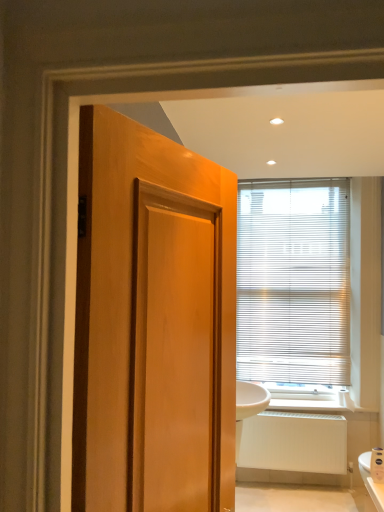
Describe the element at coordinates (293, 442) in the screenshot. I see `white matte radiator at lower right` at that location.

In order to face white matte radiator at lower right, should I rotate leftwards or rightwards?

Rotate right and turn 15.837 degrees.

Where is `white matte radiator at lower right`? white matte radiator at lower right is located at coordinates (293, 442).

This screenshot has height=512, width=384. Identify the location of white textured blinds at upper center. (293, 282).

What do you see at coordinates (293, 282) in the screenshot? I see `white textured blinds at upper center` at bounding box center [293, 282].

Measure the distance between white textured blinds at upper center and camera.

white textured blinds at upper center is 11.01 feet away from camera.

At what (x,y) coordinates should I click in order to perform the action: click on white matte radiator at lower right. Please return your answer as a coordinate pair (x, y). Looking at the image, I should click on (293, 442).

Is white textured blinds at upper center to the left or to the right of white matte radiator at lower right in the image?

From the image, it's evident that white textured blinds at upper center is to the left of white matte radiator at lower right.

Based on the photo, which object is further away from the camera taking this photo, white textured blinds at upper center or white matte radiator at lower right?

Positioned behind is white textured blinds at upper center.

Does point (257, 234) lie in front of point (264, 448)?

No, (257, 234) is behind (264, 448).

From the image's perspective, is white textured blinds at upper center located above or below white matte radiator at lower right?

Clearly, from the image's perspective, white textured blinds at upper center is above white matte radiator at lower right.

From a real-world perspective, is white textured blinds at upper center under white matte radiator at lower right?

No, from a real-world perspective, white textured blinds at upper center is not beneath white matte radiator at lower right.

Does white textured blinds at upper center have a lesser width compared to white matte radiator at lower right?

Yes.

Consider the image. Is white textured blinds at upper center taller than white matte radiator at lower right?

Yes.

Can you confirm if white textured blinds at upper center is smaller than white matte radiator at lower right?

Actually, white textured blinds at upper center might be larger than white matte radiator at lower right.

Is white textured blinds at upper center situated inside white matte radiator at lower right or outside?

The correct answer is: outside.

Is white textured blinds at upper center not close to white matte radiator at lower right?

Actually, white textured blinds at upper center and white matte radiator at lower right are a little close together.

Is white textured blinds at upper center facing towards white matte radiator at lower right?

No, white textured blinds at upper center is not facing towards white matte radiator at lower right.

How different are the orientations of white textured blinds at upper center and white matte radiator at lower right in degrees?

0.1 degrees separate the facing orientations of white textured blinds at upper center and white matte radiator at lower right.

The image size is (384, 512). What are the coordinates of `radiator in front of the white textured blinds at upper center` in the screenshot? It's located at (x=293, y=442).

Consider the image. Visually, is white matte radiator at lower right positioned to the left or to the right of white textured blinds at upper center?

In the image, white matte radiator at lower right appears on the right side of white textured blinds at upper center.

Is white matte radiator at lower right behind white textured blinds at upper center?

No, the depth of white matte radiator at lower right is less than that of white textured blinds at upper center.

Between point (340, 423) and point (294, 289), which one is positioned in front?

The point (340, 423) is closer to the camera.

From the image's perspective, relative to white textured blinds at upper center, is white matte radiator at lower right above or below?

white matte radiator at lower right is below white textured blinds at upper center.

From a real-world perspective, between white matte radiator at lower right and white textured blinds at upper center, who is vertically higher?

white textured blinds at upper center.

Considering the relative sizes of white matte radiator at lower right and white textured blinds at upper center in the image provided, is white matte radiator at lower right wider than white textured blinds at upper center?

Indeed, white matte radiator at lower right has a greater width compared to white textured blinds at upper center.

Does white matte radiator at lower right have a lesser height compared to white textured blinds at upper center?

Yes.

Considering the sizes of objects white matte radiator at lower right and white textured blinds at upper center in the image provided, who is smaller, white matte radiator at lower right or white textured blinds at upper center?

With smaller size is white matte radiator at lower right.

Is white matte radiator at lower right not within white textured blinds at upper center?

white matte radiator at lower right lies outside white textured blinds at upper center's area.

Is white matte radiator at lower right with white textured blinds at upper center?

No, white matte radiator at lower right is not touching white textured blinds at upper center.

Is white matte radiator at lower right positioned with its back to white textured blinds at upper center?

white matte radiator at lower right does not have its back to white textured blinds at upper center.

Where is `window blind behind the white matte radiator at lower right`? window blind behind the white matte radiator at lower right is located at coordinates (293, 282).

At what (x,y) coordinates should I click in order to perform the action: click on radiator lying in front of the white textured blinds at upper center. Please return your answer as a coordinate pair (x, y). Looking at the image, I should click on (293, 442).

This screenshot has width=384, height=512. In order to click on radiator on the right of white textured blinds at upper center in this screenshot , I will do `click(293, 442)`.